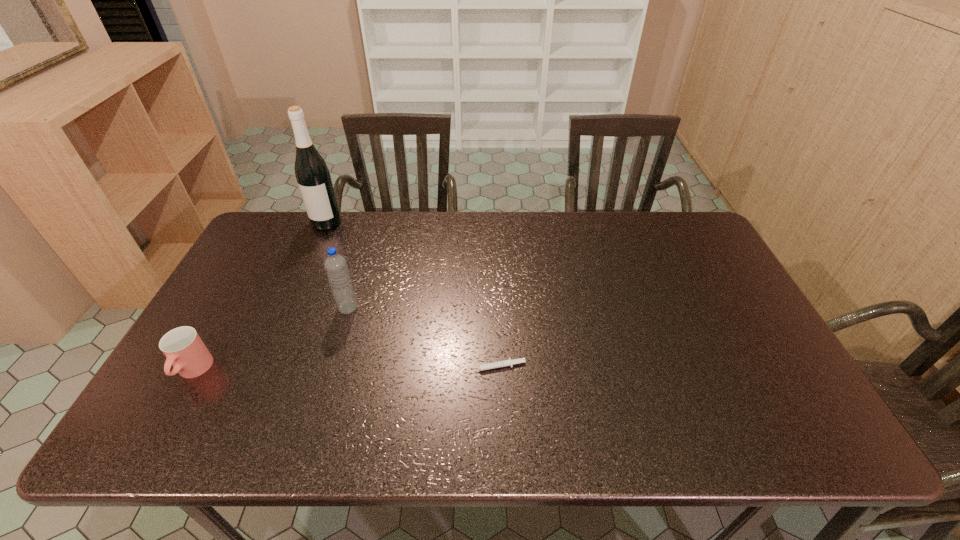
Where is `free space between the syringe and the cup`? free space between the syringe and the cup is located at coordinates (344, 369).

In order to click on unoccupied area between the second object from right to left and the leftmost object in this screenshot , I will do `click(271, 340)`.

The image size is (960, 540). I want to click on vacant space that is in between the farthest object and the cup, so click(259, 296).

Locate an element on the screen. The height and width of the screenshot is (540, 960). empty location between the farthest object and the second shortest object is located at coordinates point(259,296).

Locate an element on the screen. The width and height of the screenshot is (960, 540). free space between the farthest object and the leftmost object is located at coordinates (259, 296).

Find the location of a particular element. The image size is (960, 540). empty space between the tallest object and the syringe is located at coordinates (410, 294).

Point out which object is positioned as the second nearest to the tallest object. Please provide its 2D coordinates. Your answer should be formatted as a tuple, i.e. [(x, y)], where the tuple contains the x and y coordinates of a point satisfying the conditions above.

[(184, 349)]

At what (x,y) coordinates should I click in order to perform the action: click on the closest object to the leftmost object. Please return your answer as a coordinate pair (x, y). The width and height of the screenshot is (960, 540). Looking at the image, I should click on (335, 265).

Locate an element on the screen. The image size is (960, 540). vacant area in the image that satisfies the following two spatial constraints: 1. on the label of the syringe; 2. on the left side of the farthest object is located at coordinates (264, 367).

The image size is (960, 540). Identify the location of free space that satisfies the following two spatial constraints: 1. on the label of the water bottle; 2. on the left side of the tallest object. (289, 308).